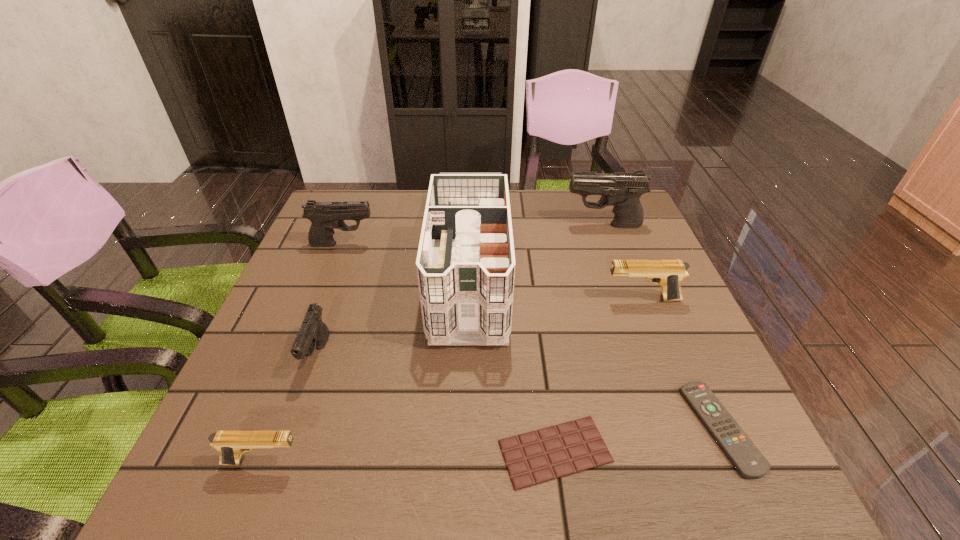
Locate an element on the screen. The width and height of the screenshot is (960, 540). the smaller tan pistol is located at coordinates (231, 444).

The image size is (960, 540). In order to click on remote control in this screenshot , I will do `click(750, 463)`.

The width and height of the screenshot is (960, 540). I want to click on the shortest object, so click(553, 452).

The image size is (960, 540). What are the coordinates of `brown chocolate bar` in the screenshot? It's located at (553, 452).

Locate an element on the screen. The image size is (960, 540). vacant point located at the entrance of the dollhouse is located at coordinates (462, 492).

Where is `free space located 0.250m at the barrel of the rightmost black pistol`? This screenshot has width=960, height=540. free space located 0.250m at the barrel of the rightmost black pistol is located at coordinates (477, 225).

I want to click on vacant space situated at the barrel of the rightmost black pistol, so click(x=519, y=225).

Locate an element on the screen. vacant area located 0.140m at the barrel of the rightmost black pistol is located at coordinates (516, 225).

Locate an element on the screen. Image resolution: width=960 pixels, height=540 pixels. vacant space located 0.160m at the barrel of the second farthest black pistol is located at coordinates (434, 244).

Where is `free spot located at the barrel of the bigger tan pistol`? The image size is (960, 540). free spot located at the barrel of the bigger tan pistol is located at coordinates (443, 299).